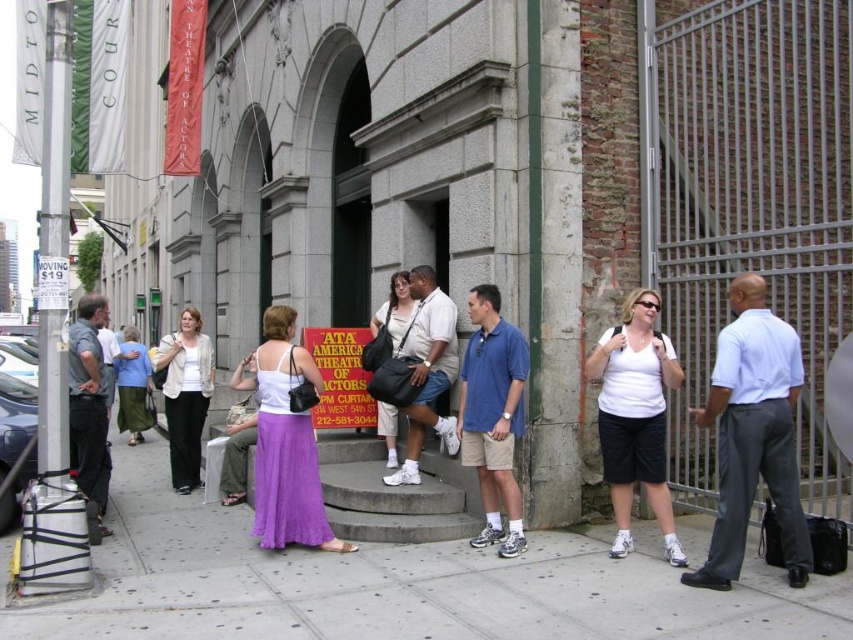
Is point (607, 365) in front of point (410, 333)?

Yes, it is.

This screenshot has width=853, height=640. In order to click on white matte tank top at center in this screenshot , I will do `click(635, 417)`.

Does concrete sidewalk at center appear over white matte tank top at center?

No, concrete sidewalk at center is not above white matte tank top at center.

Can you confirm if concrete sidewalk at center is positioned to the right of white matte tank top at center?

No, concrete sidewalk at center is not to the right of white matte tank top at center.

Between point (543, 616) and point (659, 371), which one is positioned in front?

Point (543, 616) is more forward.

Where is `concrete sidewalk at center`? concrete sidewalk at center is located at coordinates 398,586.

Is concrete sidewalk at center closer to camera compared to matte white shirt at center?

Yes.

Is concrete sidewalk at center wider than matte white shirt at center?

Correct, the width of concrete sidewalk at center exceeds that of matte white shirt at center.

In the scene shown: Measure the distance between point [579,572] and camera.

They are 6.32 meters apart.

Where is `concrete sidewalk at center`? concrete sidewalk at center is located at coordinates (398, 586).